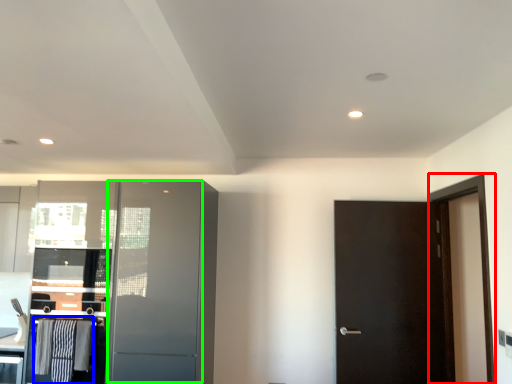
Question: Based on their relative distances, which object is farther from screen door (highlighted by a red box)? Choose from laundry (highlighted by a blue box) and screen door (highlighted by a green box).

Choices:
 (A) laundry
 (B) screen door

Answer: (A)